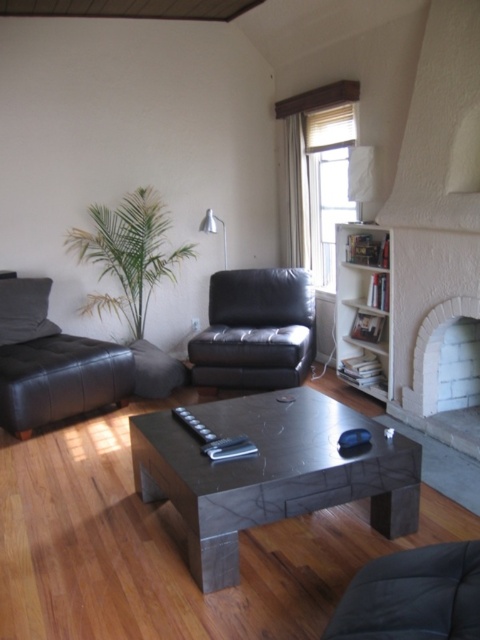
Can you confirm if matte black coffee table at center is positioned below white brick fireplace at right?

Indeed, matte black coffee table at center is positioned under white brick fireplace at right.

Can you confirm if matte black coffee table at center is bigger than white brick fireplace at right?

Indeed, matte black coffee table at center has a larger size compared to white brick fireplace at right.

Does point (194, 483) lie behind point (431, 380)?

No, (194, 483) is closer to viewer.

Locate an element on the screen. The height and width of the screenshot is (640, 480). matte black coffee table at center is located at coordinates (271, 472).

Does matte black armchair at left have a lesser height compared to white wooden bookshelf at right?

Correct, matte black armchair at left is not as tall as white wooden bookshelf at right.

Is matte black armchair at left above white wooden bookshelf at right?

No, matte black armchair at left is not above white wooden bookshelf at right.

Is point (51, 333) behind point (385, 340)?

Yes.

Locate an element on the screen. This screenshot has width=480, height=640. matte black armchair at left is located at coordinates (51, 362).

What do you see at coordinates (255, 330) in the screenshot? Image resolution: width=480 pixels, height=640 pixels. I see `black leather armchair at center` at bounding box center [255, 330].

Between point (206, 365) and point (340, 225), which one is positioned in front?

Point (340, 225) is more forward.

The width and height of the screenshot is (480, 640). I want to click on black leather armchair at center, so click(255, 330).